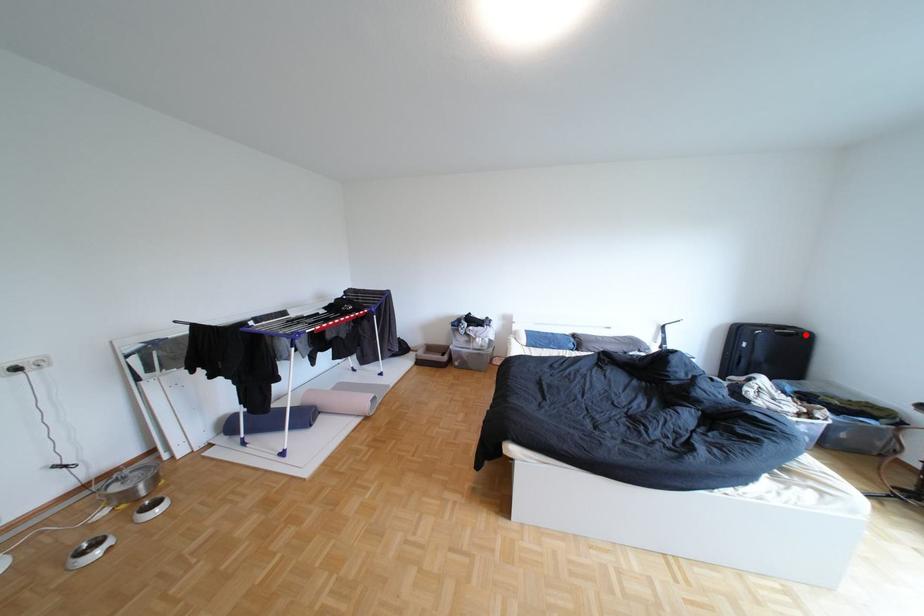
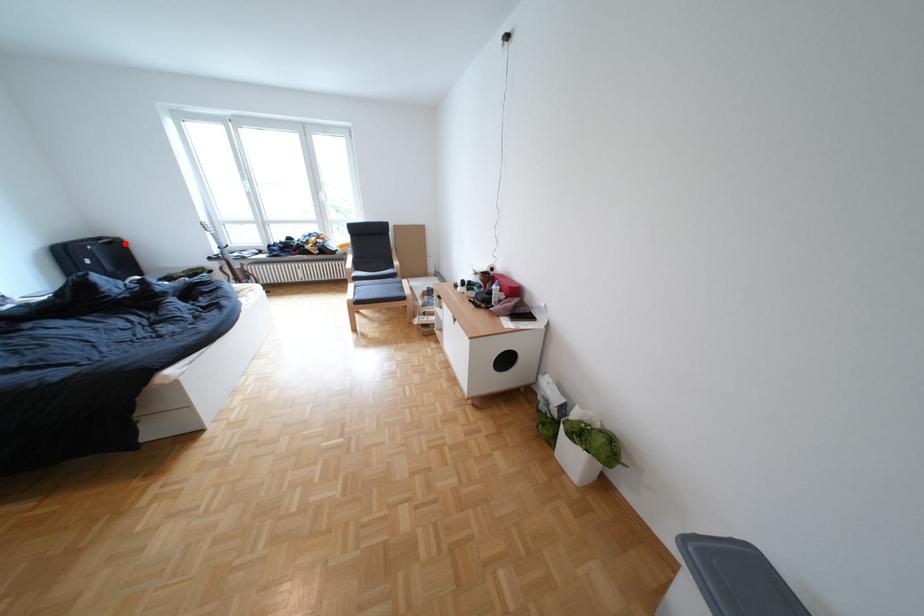
Consider the image. I am providing you with two images of the same scene from different viewpoints. A red point is marked on the first image and another point is marked on the second image. Is the marked point in image1 the same physical position as the marked point in image2?

Yes